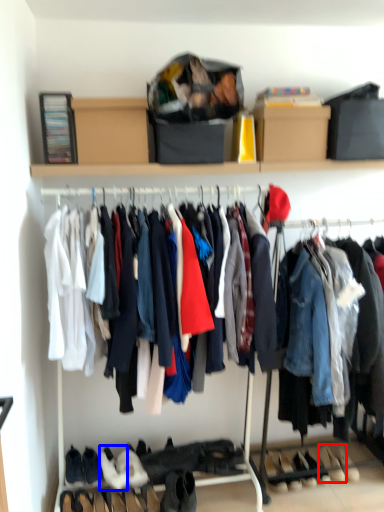
Question: Among these objects, which one is nearest to the camera, footwear (highlighted by a red box) or footwear (highlighted by a blue box)?

Choices:
 (A) footwear
 (B) footwear

Answer: (B)